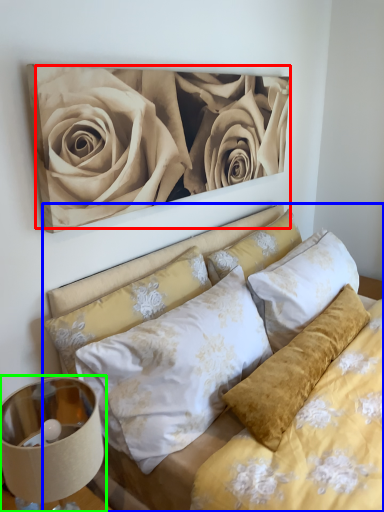
Question: Estimate the real-world distances between objects in this image. Which object is closer to rose (highlighted by a red box), bed (highlighted by a blue box) or lamp (highlighted by a green box)?

Choices:
 (A) bed
 (B) lamp

Answer: (A)